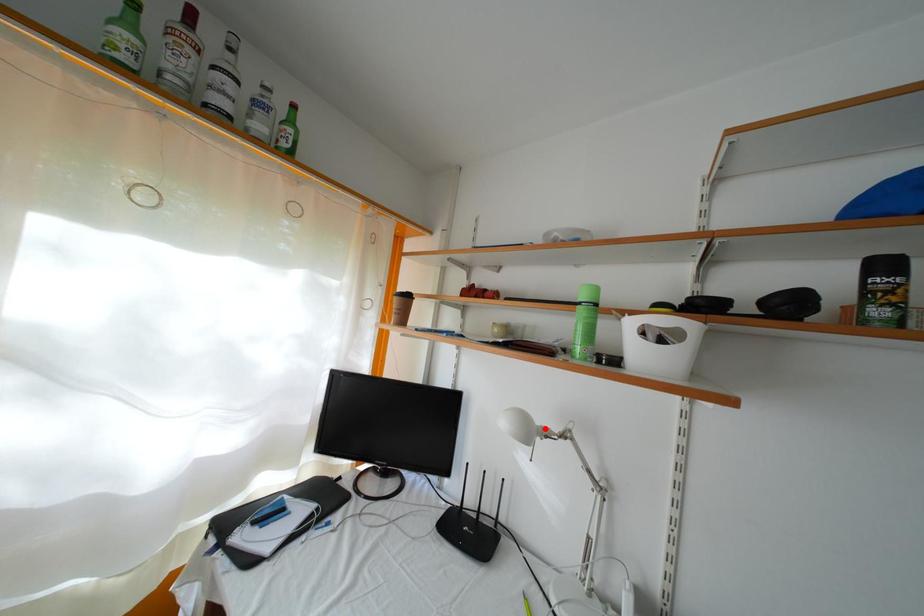
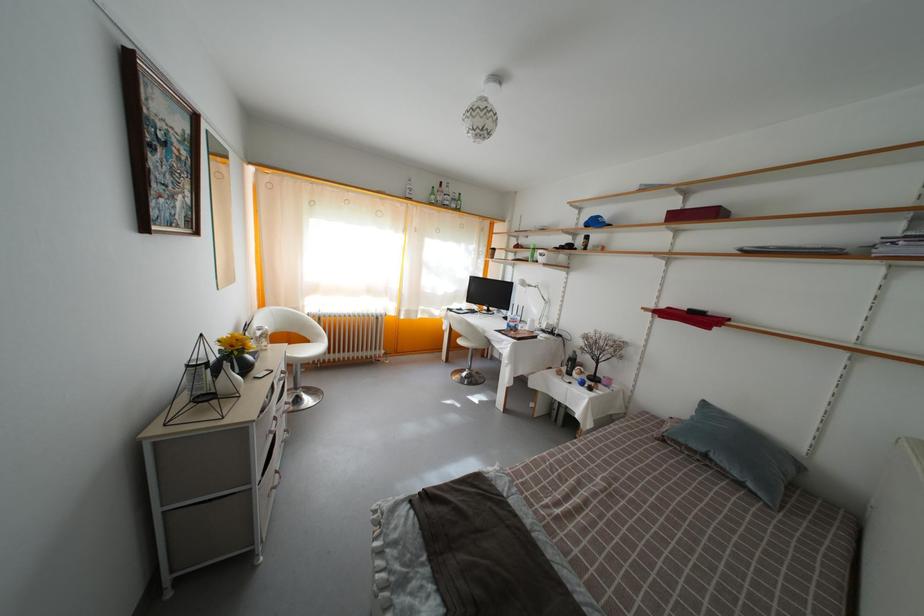
The point at the highlighted location is marked in the first image. Where is the corresponding point in the second image?

(533, 289)